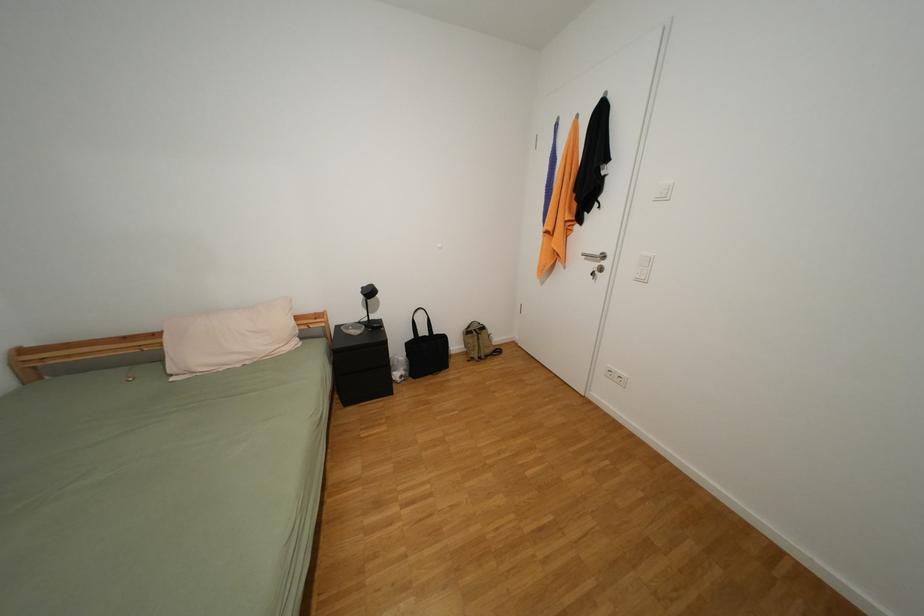
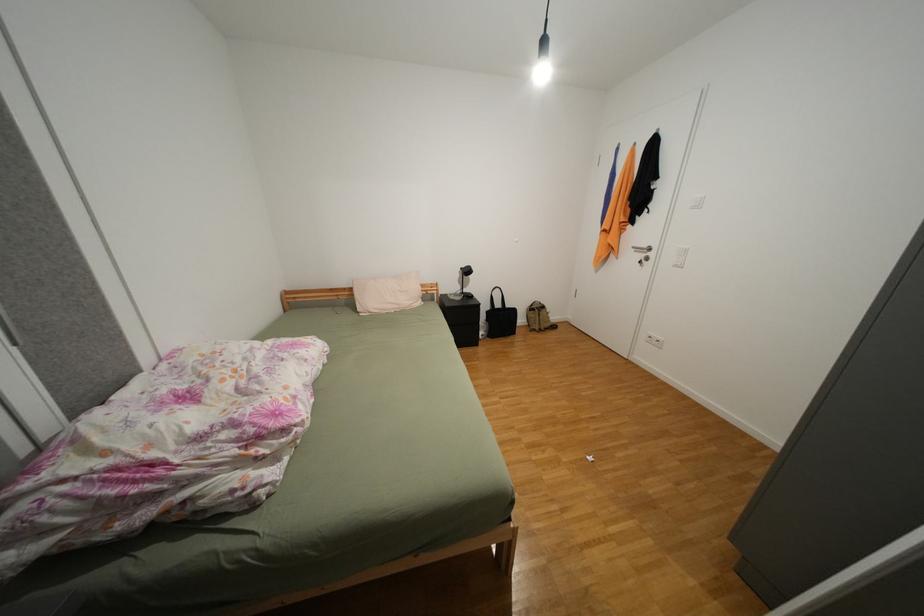
Which direction would the cameraman need to move to produce the second image?

The cameraman moved toward left, backward.